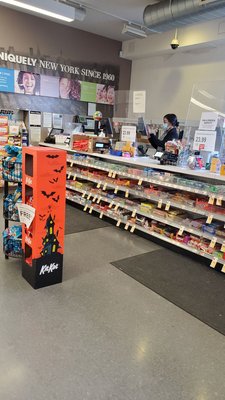
Find the location of `floor`. floor is located at coordinates (98, 305).